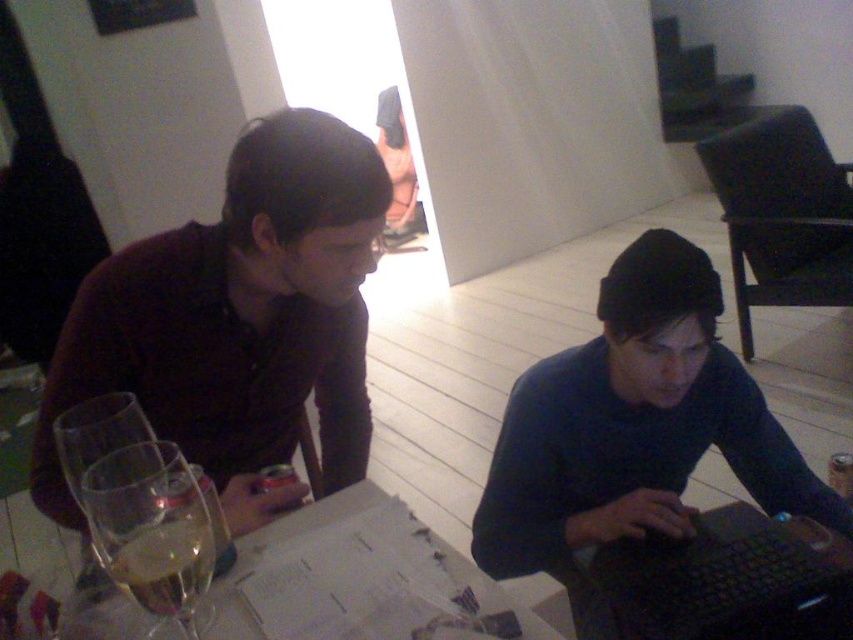
Question: Which point is farther from the camera taking this photo?

Choices:
 (A) (747, 540)
 (B) (132, 250)

Answer: (B)

Question: Which point is farther to the camera?

Choices:
 (A) (824, 541)
 (B) (173, 412)

Answer: (B)

Question: Observing the image, what is the correct spatial positioning of matte black shirt at left in reference to clear glass wine glass at lower left?

Choices:
 (A) below
 (B) above

Answer: (B)

Question: Is black matte laptop at lower right positioned at the back of clear glass wine glass at lower left?

Choices:
 (A) no
 (B) yes

Answer: (B)

Question: Which object appears farthest from the camera in this image?

Choices:
 (A) matte black shirt at left
 (B) black matte laptop at lower right
 (C) clear glass wine glass at left
 (D) clear glass wine glass at lower left

Answer: (A)

Question: Does black matte laptop at lower right have a smaller size compared to clear glass wine glass at lower left?

Choices:
 (A) yes
 (B) no

Answer: (B)